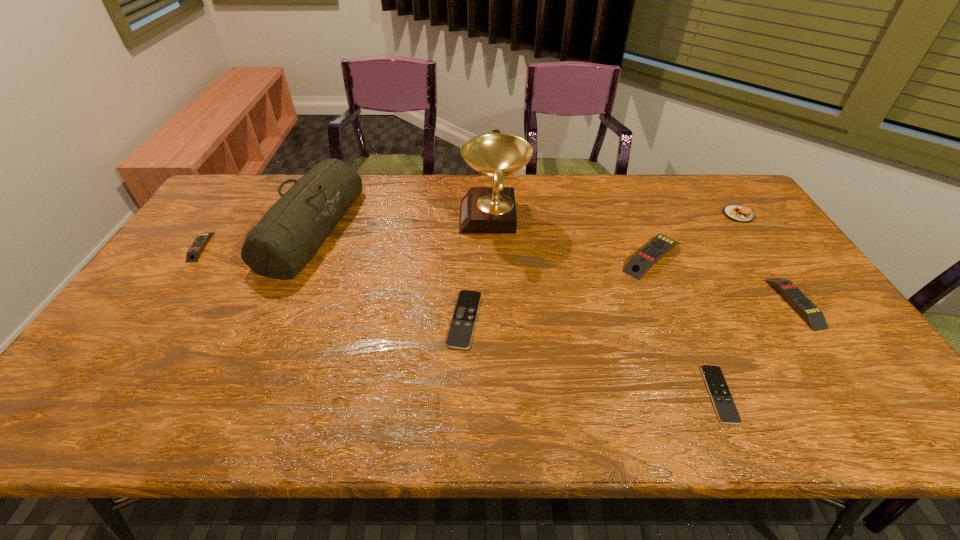
Where is `unoccupied area between the fifth tallest object and the tallest remote control`? unoccupied area between the fifth tallest object and the tallest remote control is located at coordinates (723, 280).

In order to click on vacant space that is in between the third shortest remote control and the farther black remote control in this screenshot , I will do `click(333, 283)`.

Find the location of a particular element. The height and width of the screenshot is (540, 960). vacant region between the biggest yellow remote control and the award is located at coordinates (573, 237).

The height and width of the screenshot is (540, 960). What are the coordinates of `free spot between the olive duffel bag and the second remote control from left to right` in the screenshot? It's located at (389, 274).

Find the location of a particular element. free space between the seventh tallest object and the right black remote control is located at coordinates (592, 357).

You are a GUI agent. You are given a task and a screenshot of the screen. Output one action in this format:
    pyautogui.click(x=<x>, y=<y>)
    Task: Click on the free space between the shortest remote control and the patty
    This screenshot has width=960, height=540.
    Given the screenshot: What is the action you would take?
    pyautogui.click(x=729, y=305)

What are the coordinates of `free space between the right black remote control and the olive duffel bag` in the screenshot? It's located at (516, 311).

The image size is (960, 540). What are the coordinates of `object that is the sixth closest one to the patty` in the screenshot? It's located at (291, 232).

Identify the location of the fifth closest object to the patty. (460, 333).

You are a GUI agent. You are given a task and a screenshot of the screen. Output one action in this format:
    pyautogui.click(x=<x>, y=<y>)
    Task: Click on the remote control that is the fourth closest one to the tallest object
    
    Given the screenshot: What is the action you would take?
    pyautogui.click(x=814, y=317)